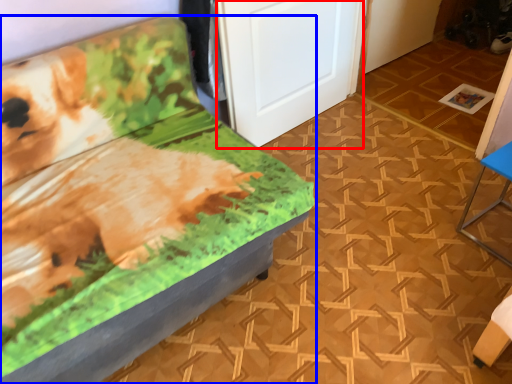
Question: Among these objects, which one is nearest to the camera, door (highlighted by a red box) or furniture (highlighted by a blue box)?

Choices:
 (A) door
 (B) furniture

Answer: (B)